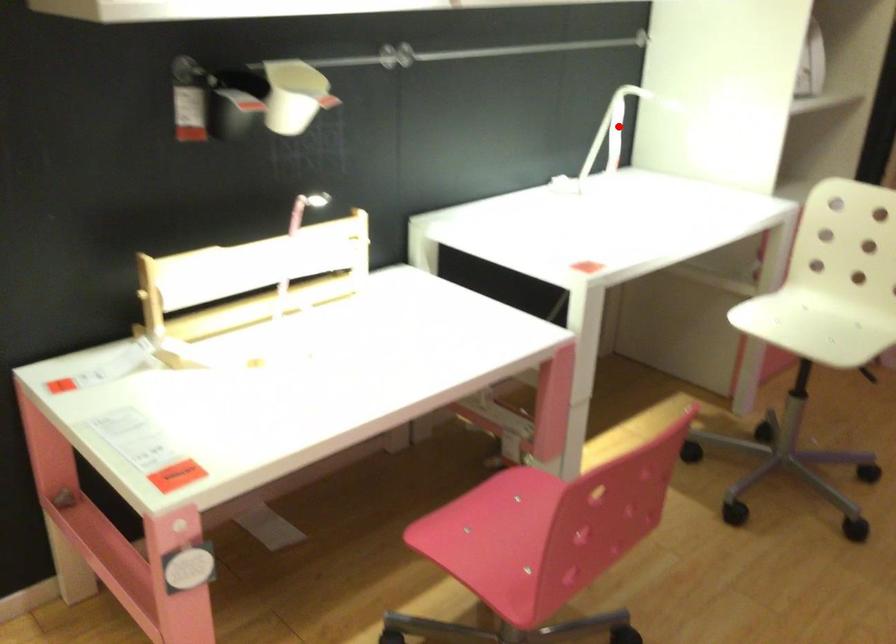
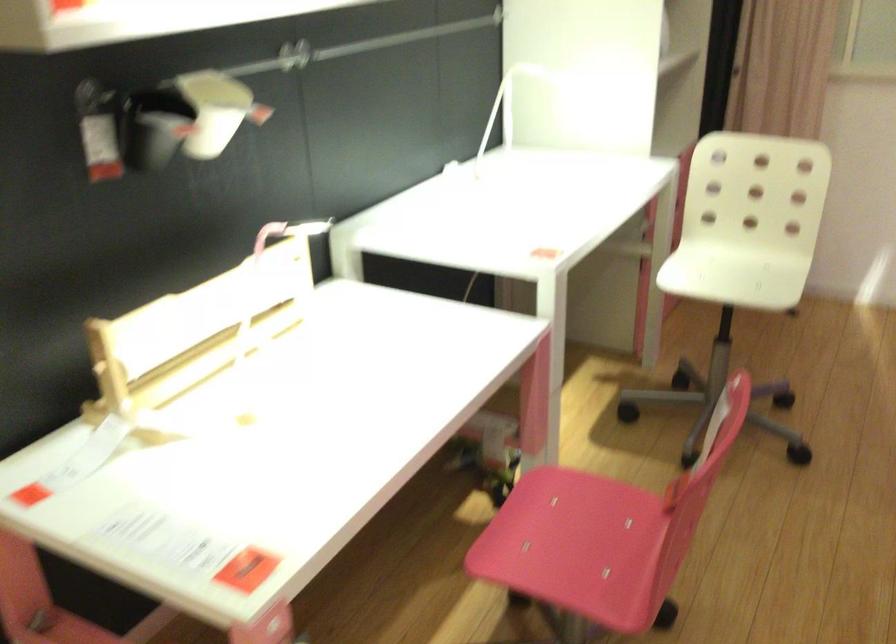
Question: I am providing you with two images of the same scene from different viewpoints. A red point is marked on the first image. Is the red point's position out of view in image 2?

Choices:
 (A) Yes
 (B) No

Answer: (A)